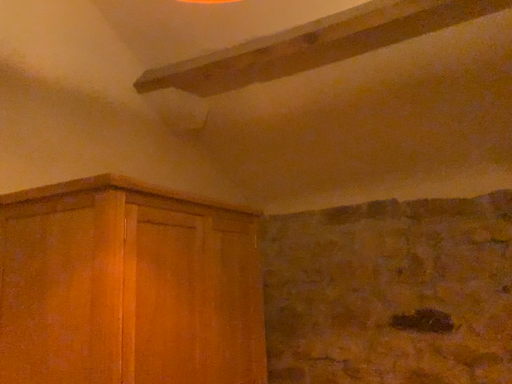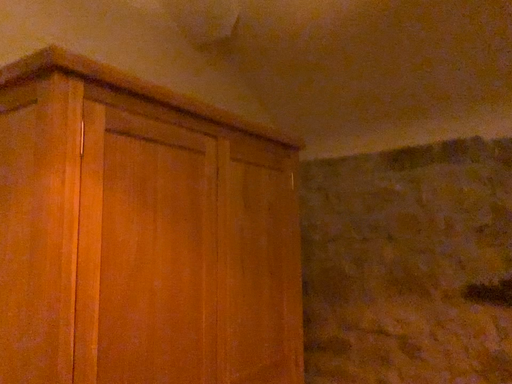
Question: Which way did the camera rotate in the video?

Choices:
 (A) rotated right
 (B) rotated left

Answer: (B)